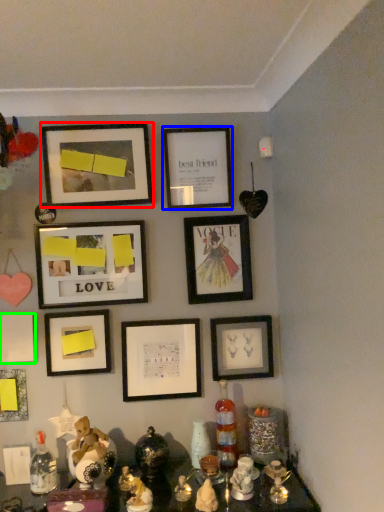
Question: Based on their relative distances, which object is farther from picture frame (highlighted by a red box)? Choose from picture frame (highlighted by a blue box) and picture frame (highlighted by a green box).

Choices:
 (A) picture frame
 (B) picture frame

Answer: (B)